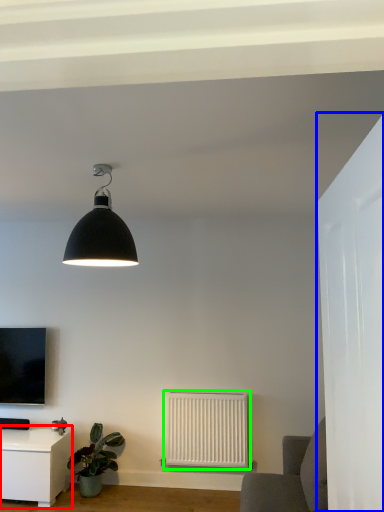
Question: Which object is positioned farthest from table (highlighted by a red box)? Select from glass door (highlighted by a blue box) and radiator (highlighted by a green box).

Choices:
 (A) glass door
 (B) radiator

Answer: (A)